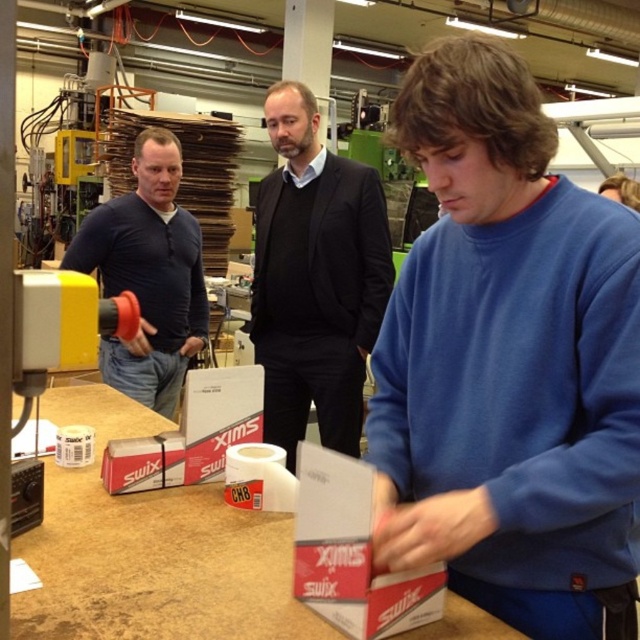
Question: Estimate the real-world distances between objects in this image. Which object is closer to the blue cotton sweatshirt at center?

Choices:
 (A) black matte suit at center
 (B) matte black shirt at left

Answer: (A)

Question: Which of these objects is positioned farthest from the matte black shirt at left?

Choices:
 (A) blue cotton sweatshirt at center
 (B) black matte suit at center

Answer: (A)

Question: Is black matte suit at center bigger than matte black shirt at left?

Choices:
 (A) yes
 (B) no

Answer: (A)

Question: Does blue cotton sweatshirt at center have a lesser width compared to black matte suit at center?

Choices:
 (A) no
 (B) yes

Answer: (B)

Question: Is blue cotton sweatshirt at center to the left of matte black shirt at left from the viewer's perspective?

Choices:
 (A) yes
 (B) no

Answer: (B)

Question: Estimate the real-world distances between objects in this image. Which object is farther from the blue cotton sweatshirt at center?

Choices:
 (A) black matte suit at center
 (B) matte black shirt at left

Answer: (B)